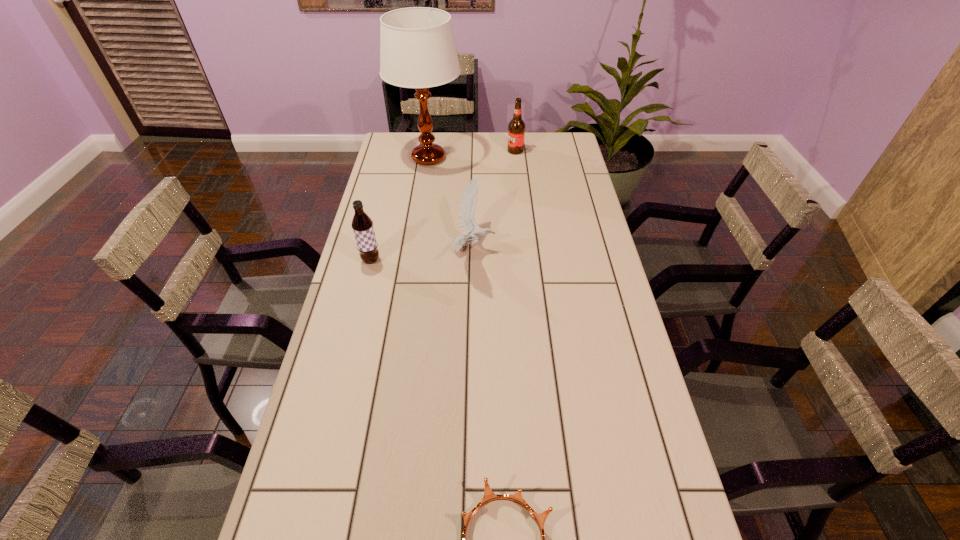
Where is `free point between the left root beer and the right root beer`? This screenshot has width=960, height=540. free point between the left root beer and the right root beer is located at coordinates (444, 206).

Find the location of a particular element. The image size is (960, 540). free space between the farther root beer and the table lamp is located at coordinates (472, 154).

Identify which object is the third closest to the nearer root beer. Please provide its 2D coordinates. Your answer should be formatted as a tuple, i.e. [(x, y)], where the tuple contains the x and y coordinates of a point satisfying the conditions above.

[(489, 496)]

Locate an element on the screen. This screenshot has width=960, height=540. object that is the second closest to the farther root beer is located at coordinates (467, 207).

Where is `free spot that satisfies the following two spatial constraints: 1. on the back side of the farther root beer; 2. on the left side of the tallest object`? The height and width of the screenshot is (540, 960). free spot that satisfies the following two spatial constraints: 1. on the back side of the farther root beer; 2. on the left side of the tallest object is located at coordinates (430, 151).